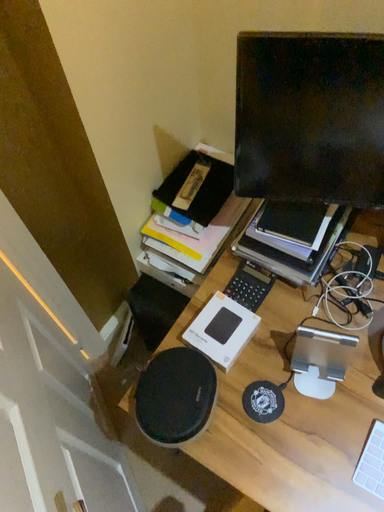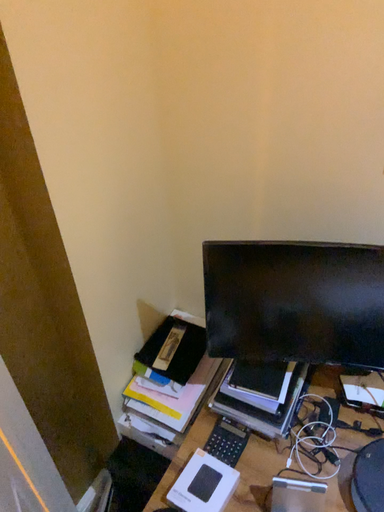
Question: Which way did the camera rotate in the video?

Choices:
 (A) rotated downward
 (B) rotated upward

Answer: (B)